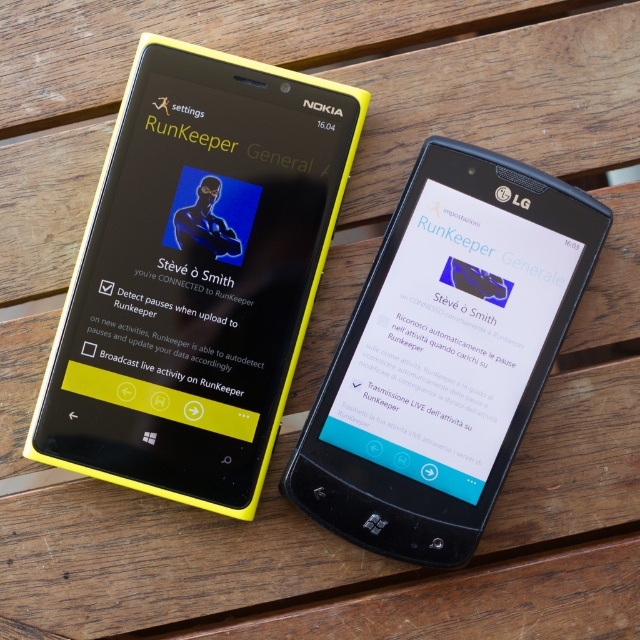
Is yellow plastic nokia smartphone at left positioned in front of black glossy lg smartphone at center?

No.

Is point (296, 125) positioned after point (417, 289)?

Yes, it is behind point (417, 289).

Is point (342, 134) positioned after point (326, 433)?

Yes.

Locate an element on the screen. This screenshot has height=640, width=640. yellow plastic nokia smartphone at left is located at coordinates (195, 276).

Is black glossy lg smartphone at center to the left of blue matte icon at center from the viewer's perspective?

Incorrect, black glossy lg smartphone at center is not on the left side of blue matte icon at center.

Who is shorter, black glossy lg smartphone at center or blue matte icon at center?

With less height is blue matte icon at center.

Between point (448, 493) and point (211, 216), which one is positioned in front?

Positioned in front is point (448, 493).

I want to click on black glossy lg smartphone at center, so click(x=444, y=353).

The image size is (640, 640). What do you see at coordinates (195, 276) in the screenshot? I see `yellow plastic nokia smartphone at left` at bounding box center [195, 276].

From the picture: Who is higher up, yellow plastic nokia smartphone at left or blue matte icon at center?

blue matte icon at center is higher up.

Between point (323, 240) and point (209, 241), which one is positioned behind?

The point (323, 240) is more distant.

The width and height of the screenshot is (640, 640). Find the location of `yellow plastic nokia smartphone at left`. yellow plastic nokia smartphone at left is located at coordinates (195, 276).